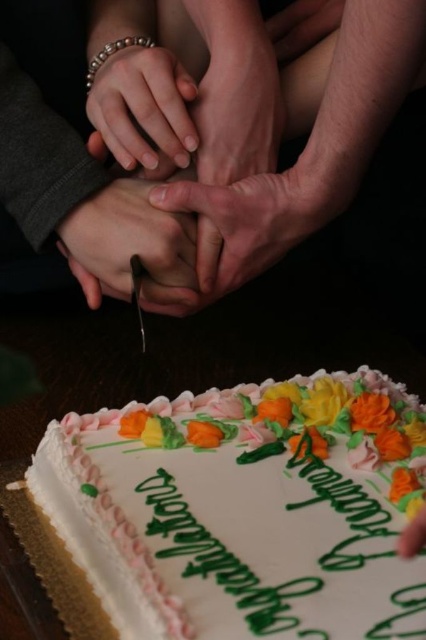
Between matte skin hand at center and smooth skin hand at center, which one appears on the left side from the viewer's perspective?

From the viewer's perspective, matte skin hand at center appears more on the left side.

Is matte skin hand at center below smooth skin hand at center?

No, matte skin hand at center is not below smooth skin hand at center.

At what (x,y) coordinates should I click in order to perform the action: click on matte skin hand at center. Please return your answer as a coordinate pair (x, y). Looking at the image, I should click on (131, 246).

Between matte skin hands at center and matte gold bracelet at center, which one is positioned higher?

matte gold bracelet at center is higher up.

Which of these two, matte skin hands at center or matte gold bracelet at center, stands taller?

With more height is matte skin hands at center.

Who is more forward, (213, 76) or (152, 157)?

Point (152, 157)

Find the location of `matte skin hands at center`. matte skin hands at center is located at coordinates (187, 134).

Does white frosted cake at lower center appear on the right side of matte skin hand at center?

Indeed, white frosted cake at lower center is positioned on the right side of matte skin hand at center.

What are the coordinates of `white frosted cake at lower center` in the screenshot? It's located at (245, 509).

Who is more forward, (265, 387) or (166, 212)?

Point (265, 387) is in front.

Locate an element on the screen. The height and width of the screenshot is (640, 426). white frosted cake at lower center is located at coordinates (245, 509).